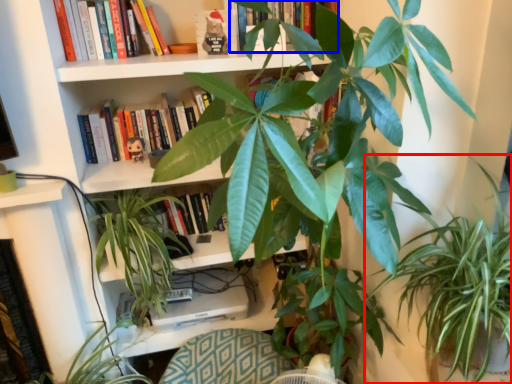
Question: Which object appears closest to the camera in this image, houseplant (highlighted by a red box) or book (highlighted by a blue box)?

Choices:
 (A) houseplant
 (B) book

Answer: (A)